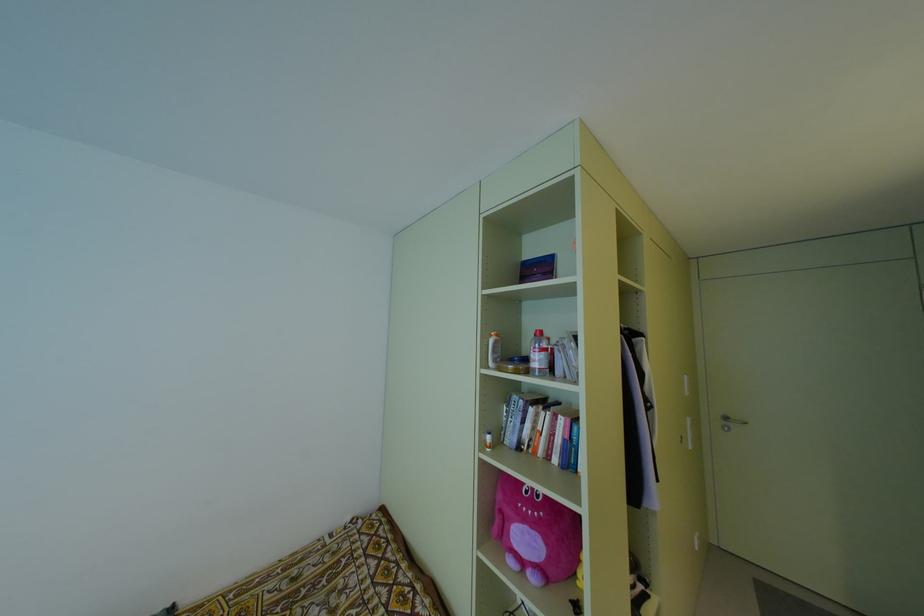
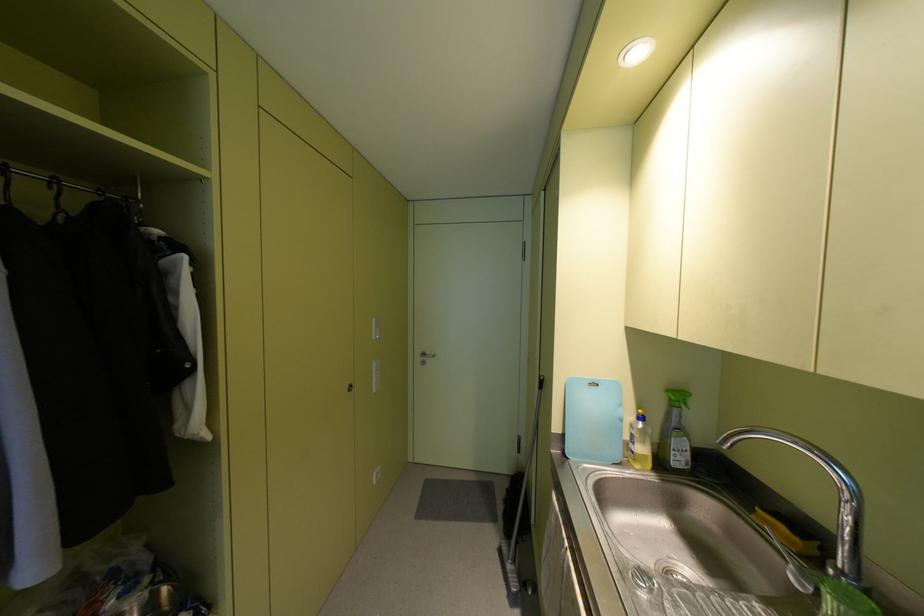
The point at (686, 392) is marked in the first image. Where is the corresponding point in the second image?

(373, 336)